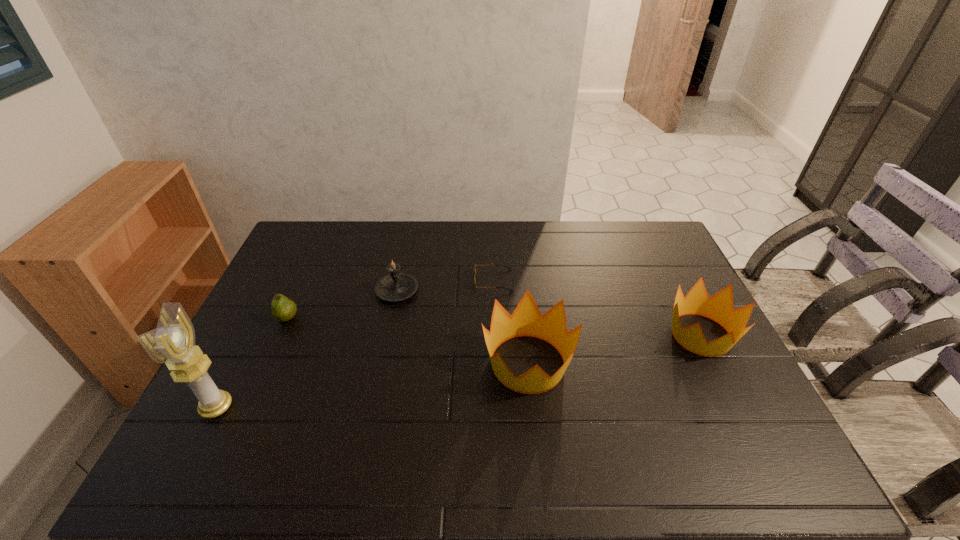
The image size is (960, 540). I want to click on the fifth shortest object, so click(526, 320).

Find the location of a particular element. The height and width of the screenshot is (540, 960). the taller crown is located at coordinates (526, 320).

Where is `the rightmost object`? The height and width of the screenshot is (540, 960). the rightmost object is located at coordinates (719, 307).

What are the coordinates of `the right crown` in the screenshot? It's located at (719, 307).

Find the location of `candle`. candle is located at coordinates (396, 286).

Locate an element on the screen. The height and width of the screenshot is (540, 960). the shortest object is located at coordinates (508, 267).

Locate an element on the screen. This screenshot has width=960, height=540. pear is located at coordinates (283, 309).

At what (x,y) coordinates should I click in order to perform the action: click on the fifth tallest object. Please return your answer as a coordinate pair (x, y). Image resolution: width=960 pixels, height=540 pixels. Looking at the image, I should click on (283, 309).

Where is `the tallest object`? The image size is (960, 540). the tallest object is located at coordinates (172, 343).

In order to click on the leftmost object in this screenshot , I will do click(x=172, y=343).